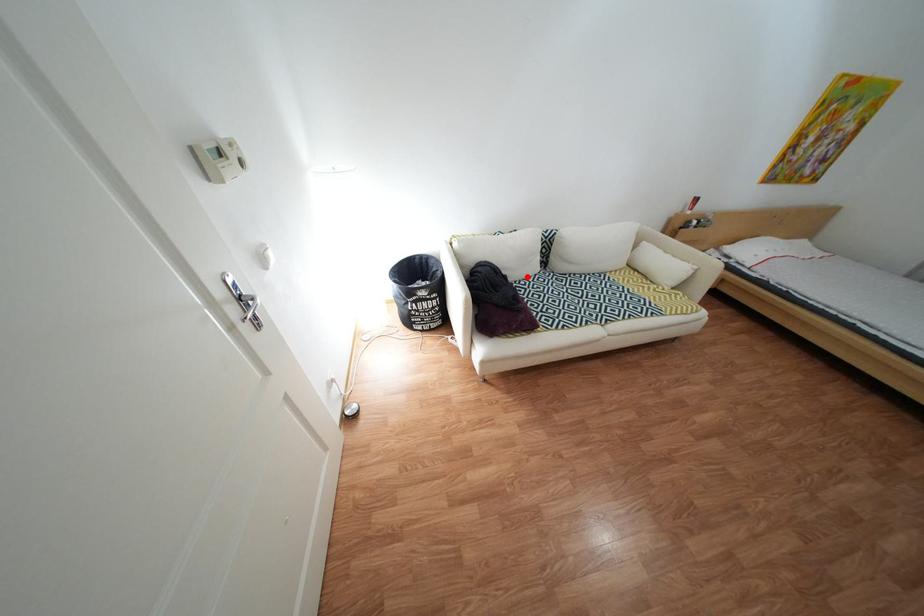
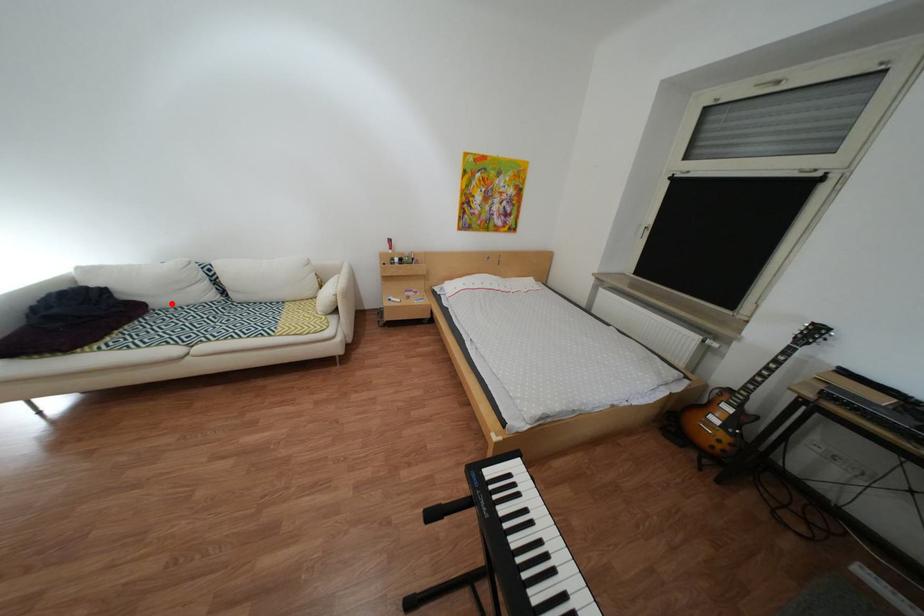
I am providing you with two images of the same scene from different viewpoints. A red point is marked on the first image and another point is marked on the second image. Are the points marked in image1 and image2 representing the same 3D position?

Yes